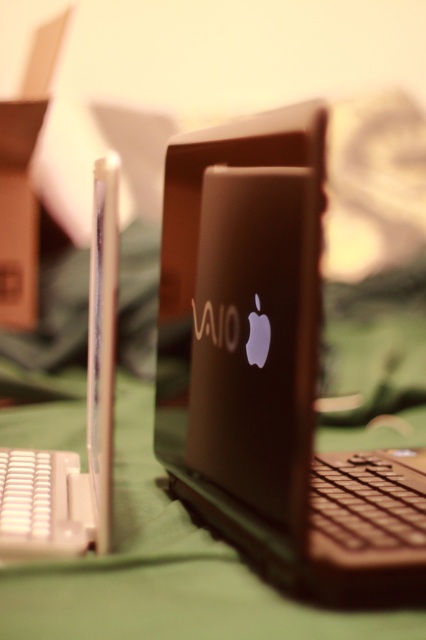
You are organizing a tech fair and need to stack the satin black laptop at center and the satin black laptop at left vertically on a shelf. Based on their heights, which one should be placed at the bottom to ensure stability?

The satin black laptop at center is taller than the satin black laptop at left, so placing the taller one at the bottom would provide a stable base. Therefore, the satin black laptop at center should be placed at the bottom.

You are a photographer adjusting your camera settings to capture both laptops clearly. Since the satin black laptop at center and the satin black laptop at left are both in focus, which one should you move closer to the camera to make it stand out more?

To make the satin black laptop at center stand out more, move it closer to the camera because it is already closer to the viewer than the satin black laptop at left.

You are organizing a tech fair and need to display two laptops. The satin black laptop at center and the satin black laptop at left are both available. If you have a shelf that can only hold one of them, which one should you choose to maximize the visual impact?

The satin black laptop at center is larger in size than the satin black laptop at left, so choosing the satin black laptop at center would maximize visual impact as it occupies more space and draws attention.